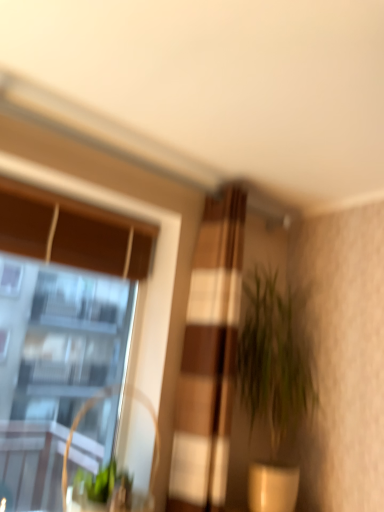
Question: Is green leafy plant at center-right not near textured beige curtain at center?

Choices:
 (A) no
 (B) yes

Answer: (A)

Question: Can textured beige curtain at center be found inside green leafy plant at center-right?

Choices:
 (A) yes
 (B) no

Answer: (B)

Question: Is green leafy plant at center-right next to textured beige curtain at center and touching it?

Choices:
 (A) no
 (B) yes

Answer: (A)

Question: Considering the relative sizes of green leafy plant at center-right and textured beige curtain at center in the image provided, is green leafy plant at center-right bigger than textured beige curtain at center?

Choices:
 (A) no
 (B) yes

Answer: (B)

Question: Can you confirm if green leafy plant at center-right is thinner than textured beige curtain at center?

Choices:
 (A) yes
 (B) no

Answer: (B)

Question: In terms of height, does clear glass window at upper left look taller or shorter compared to textured beige curtain at center?

Choices:
 (A) tall
 (B) short

Answer: (B)

Question: Looking at their shapes, would you say clear glass window at upper left is wider or thinner than textured beige curtain at center?

Choices:
 (A) thin
 (B) wide

Answer: (A)

Question: From a real-world perspective, is clear glass window at upper left positioned above or below textured beige curtain at center?

Choices:
 (A) below
 (B) above

Answer: (A)

Question: From the image's perspective, is clear glass window at upper left above or below textured beige curtain at center?

Choices:
 (A) below
 (B) above

Answer: (A)

Question: Would you say metallic silver swivel chair at left is inside or outside clear glass window at upper left?

Choices:
 (A) inside
 (B) outside

Answer: (B)

Question: Considering the positions of metallic silver swivel chair at left and clear glass window at upper left in the image, is metallic silver swivel chair at left bigger or smaller than clear glass window at upper left?

Choices:
 (A) big
 (B) small

Answer: (B)

Question: In the image, is metallic silver swivel chair at left positioned in front of or behind clear glass window at upper left?

Choices:
 (A) front
 (B) behind

Answer: (A)

Question: Does point (130, 397) appear closer or farther from the camera than point (91, 336)?

Choices:
 (A) farther
 (B) closer

Answer: (B)

Question: In the image, is textured beige curtain at center on the left side or the right side of green leafy plant at center-right?

Choices:
 (A) right
 (B) left

Answer: (B)

Question: Looking at the image, does textured beige curtain at center seem bigger or smaller compared to green leafy plant at center-right?

Choices:
 (A) small
 (B) big

Answer: (A)